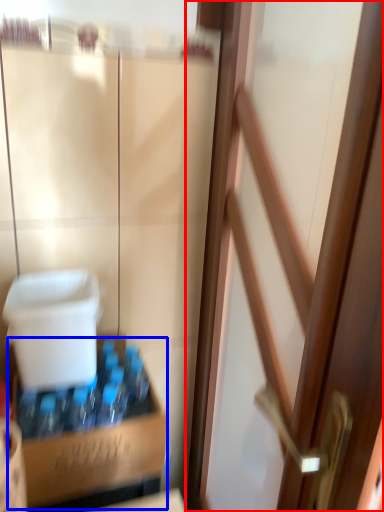
Question: Which object appears farthest to the camera in this image, door (highlighted by a red box) or cardboard box (highlighted by a blue box)?

Choices:
 (A) door
 (B) cardboard box

Answer: (B)